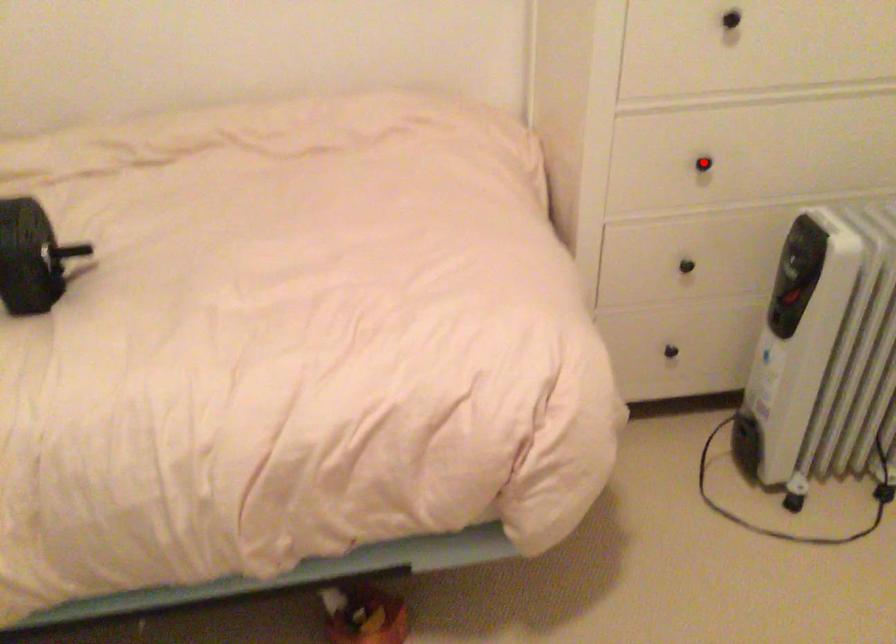
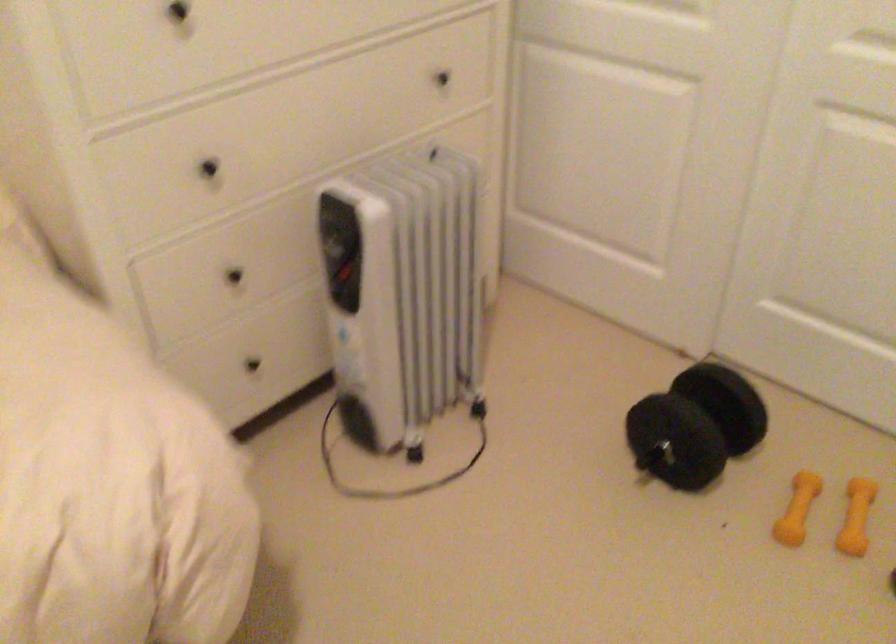
Locate, in the second image, the point that corresponds to the highlighted location in the first image.

(209, 167)